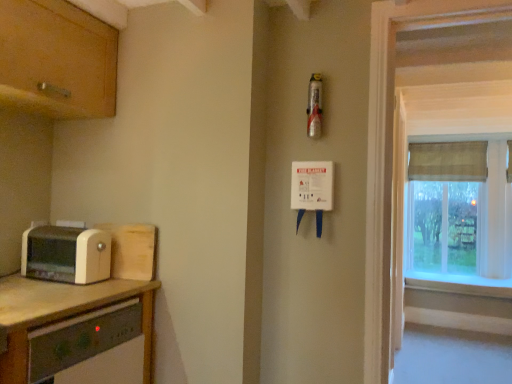
Question: Is white laminate countertop at lower left completely or partially outside of white painted wood at right?

Choices:
 (A) no
 (B) yes

Answer: (B)

Question: Is white laminate countertop at lower left turned away from white painted wood at right?

Choices:
 (A) yes
 (B) no

Answer: (B)

Question: Can you confirm if white laminate countertop at lower left is thinner than white painted wood at right?

Choices:
 (A) yes
 (B) no

Answer: (B)

Question: Considering the relative positions of white laminate countertop at lower left and white painted wood at right in the image provided, is white laminate countertop at lower left behind white painted wood at right?

Choices:
 (A) yes
 (B) no

Answer: (B)

Question: Considering the relative sizes of white laminate countertop at lower left and white painted wood at right in the image provided, is white laminate countertop at lower left smaller than white painted wood at right?

Choices:
 (A) yes
 (B) no

Answer: (B)

Question: Does white laminate countertop at lower left come in front of white painted wood at right?

Choices:
 (A) no
 (B) yes

Answer: (B)

Question: Is wooden window frame at right oriented away from white painted wood at right?

Choices:
 (A) no
 (B) yes

Answer: (B)

Question: Considering the relative sizes of wooden window frame at right and white painted wood at right in the image provided, is wooden window frame at right thinner than white painted wood at right?

Choices:
 (A) no
 (B) yes

Answer: (B)

Question: Are wooden window frame at right and white painted wood at right making contact?

Choices:
 (A) yes
 (B) no

Answer: (B)

Question: Is wooden window frame at right oriented towards white painted wood at right?

Choices:
 (A) yes
 (B) no

Answer: (B)

Question: Is white painted wood at right a part of wooden window frame at right?

Choices:
 (A) yes
 (B) no

Answer: (B)

Question: Can you confirm if wooden window frame at right is taller than white painted wood at right?

Choices:
 (A) no
 (B) yes

Answer: (B)

Question: Is beige plastic toaster at left surrounded by white painted wood at right?

Choices:
 (A) yes
 (B) no

Answer: (B)